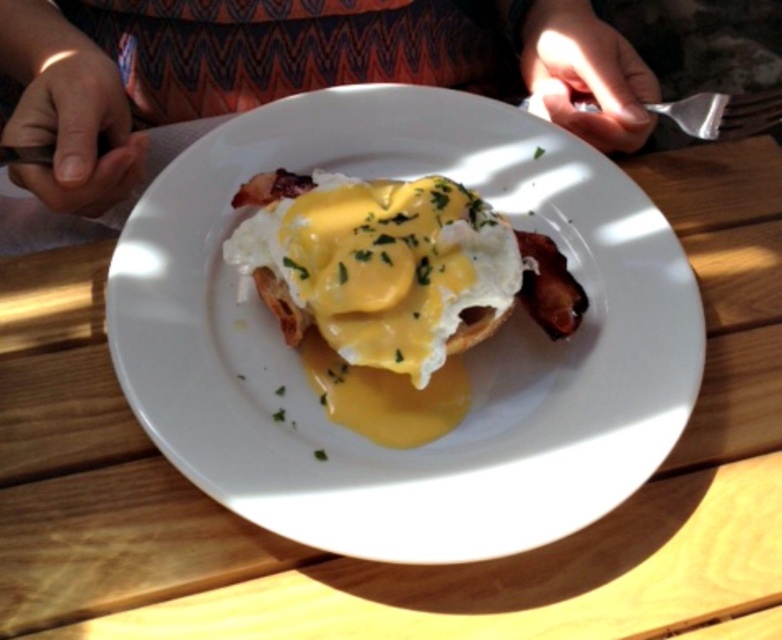
Between point (368, 321) and point (31, 186), which one is positioned behind?

The point (31, 186) is more distant.

The width and height of the screenshot is (782, 640). What are the coordinates of `white creamy egg at center` in the screenshot? It's located at (384, 268).

Which is more to the left, white glossy plate at center or patterned fabric shirt at center?

patterned fabric shirt at center is more to the left.

How much distance is there between white glossy plate at center and patterned fabric shirt at center?

The distance of white glossy plate at center from patterned fabric shirt at center is 8.23 inches.

At what (x,y) coordinates should I click in order to perform the action: click on white glossy plate at center. Please return your answer as a coordinate pair (x, y). The width and height of the screenshot is (782, 640). Looking at the image, I should click on (463, 355).

From the picture: Can you confirm if metallic silver fork at upper right is positioned below silver metallic fork at upper right?

Incorrect, metallic silver fork at upper right is not positioned below silver metallic fork at upper right.

Which is behind, point (701, 68) or point (698, 129)?

Point (701, 68)

Locate an element on the screen. The image size is (782, 640). metallic silver fork at upper right is located at coordinates (701, 42).